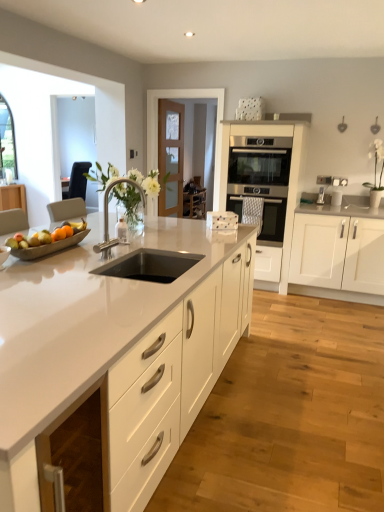
What is the approximate height of white glossy vase at right?

white glossy vase at right is 67.14 centimeters tall.

Find the location of a particular element. wooden chair at center is located at coordinates (194, 198).

This screenshot has height=512, width=384. Find the location of `white glossy cabinet at center, the third cabinetry viewed from the right`. white glossy cabinet at center, the third cabinetry viewed from the right is located at coordinates (118, 353).

This screenshot has width=384, height=512. Describe the element at coordinates (49, 243) in the screenshot. I see `matte gray tray at left` at that location.

Find the location of `white glossy vase at right`. white glossy vase at right is located at coordinates (376, 164).

In terms of size, does wooden chair at center appear bigger or smaller than satin silver oven at center?

wooden chair at center is bigger than satin silver oven at center.

Is wooden chair at center completely or partially outside of satin silver oven at center?

That's correct, wooden chair at center is outside of satin silver oven at center.

From the image's perspective, does wooden chair at center appear higher than satin silver oven at center?

Yes, from the image's perspective, wooden chair at center is on top of satin silver oven at center.

Is wooden chair at center far from satin silver oven at center?

Indeed, wooden chair at center is not near satin silver oven at center.

Is satin stainless steel oven at center, which is the second cabinetry in left-to-right order, not close to white matte cabinet at right, the 3th cabinetry viewed from the left?

satin stainless steel oven at center, which is the second cabinetry in left-to-right order, is near white matte cabinet at right, the 3th cabinetry viewed from the left, not far away.

Considering the sizes of satin stainless steel oven at center, arranged as the 2th cabinetry when viewed from the right, and white matte cabinet at right, the 1th cabinetry viewed from the right, in the image, is satin stainless steel oven at center, arranged as the 2th cabinetry when viewed from the right, taller or shorter than white matte cabinet at right, the 1th cabinetry viewed from the right,?

Considering their sizes, satin stainless steel oven at center, arranged as the 2th cabinetry when viewed from the right, has more height than white matte cabinet at right, the 1th cabinetry viewed from the right.

Between satin stainless steel oven at center, arranged as the 2th cabinetry when viewed from the right, and polished chrome faucet at center, which one has smaller size?

polished chrome faucet at center.

Between satin stainless steel oven at center, which is the second cabinetry in left-to-right order, and polished chrome faucet at center, which one has less height?

polished chrome faucet at center is shorter.

Which cabinetry is the 2nd one when counting from the back of the polished chrome faucet at center? Please provide its 2D coordinates.

[(290, 172)]

In the image, is satin stainless steel oven at center, which is the second cabinetry in left-to-right order, on the left side or the right side of polished chrome faucet at center?

Based on their positions, satin stainless steel oven at center, which is the second cabinetry in left-to-right order, is located to the right of polished chrome faucet at center.

Where is `oven that appears below the black stainless steel sink at center (from a real-world perspective)`? This screenshot has width=384, height=512. oven that appears below the black stainless steel sink at center (from a real-world perspective) is located at coordinates (273, 219).

From a real-world perspective, which is physically below, black stainless steel sink at center or satin silver oven at center?

satin silver oven at center is physically lower.

Which is more to the right, black stainless steel sink at center or satin silver oven at center?

satin silver oven at center.

Based on the photo, is there a large distance between black stainless steel sink at center and satin silver oven at center?

That's right, there is a large distance between black stainless steel sink at center and satin silver oven at center.

Considering the relative positions of black stainless steel sink at center and matte gray tray at left in the image provided, is black stainless steel sink at center to the right of matte gray tray at left from the viewer's perspective?

Yes, black stainless steel sink at center is to the right of matte gray tray at left.

Is the surface of black stainless steel sink at center in direct contact with matte gray tray at left?

No, black stainless steel sink at center is not with matte gray tray at left.

Which of these two, black stainless steel sink at center or matte gray tray at left, stands shorter?

With less height is matte gray tray at left.

Is satin silver oven at center facing away from black stainless steel sink at center?

No, satin silver oven at center is not facing away from black stainless steel sink at center.

How different are the orientations of satin silver oven at center and black stainless steel sink at center in degrees?

They differ by 90.7 degrees in their facing directions.

Is satin silver oven at center smaller than black stainless steel sink at center?

Actually, satin silver oven at center might be larger than black stainless steel sink at center.

Considering the sizes of satin silver oven at center and black stainless steel sink at center in the image, is satin silver oven at center wider or thinner than black stainless steel sink at center?

Clearly, satin silver oven at center has more width compared to black stainless steel sink at center.

Considering the sizes of objects polished chrome faucet at center and white glossy vase at right in the image provided, who is thinner, polished chrome faucet at center or white glossy vase at right?

polished chrome faucet at center.

Would you say polished chrome faucet at center is inside or outside white glossy vase at right?

The correct answer is: outside.

Who is taller, polished chrome faucet at center or white glossy vase at right?

white glossy vase at right is taller.

From a real-world perspective, relative to white glossy vase at right, is polished chrome faucet at center vertically above or below?

In terms of real-world spatial position, polished chrome faucet at center is below white glossy vase at right.

At what (x,y) coordinates should I click in order to perform the action: click on oven in front of the wooden chair at center. Please return your answer as a coordinate pair (x, y). This screenshot has width=384, height=512. Looking at the image, I should click on (273, 219).

This screenshot has height=512, width=384. I want to click on the 1st cabinetry located beneath the satin stainless steel oven at center, arranged as the 2th cabinetry when viewed from the right (from a real-world perspective), so click(330, 244).

Based on their spatial positions, is satin stainless steel oven at center, arranged as the 2th cabinetry when viewed from the right, or white glossy cabinet at center, placed as the 1th cabinetry when sorted from left to right, closer to black stainless steel sink at center?

Among the two, white glossy cabinet at center, placed as the 1th cabinetry when sorted from left to right, is located nearer to black stainless steel sink at center.

Considering their positions, is polished chrome faucet at center positioned further to satin silver oven at center than white matte cabinet at right, the 3th cabinetry viewed from the left?

polished chrome faucet at center is positioned further to the anchor satin silver oven at center.

When comparing their distances from matte gray tray at left, does satin silver oven at center or white matte cabinet at right, the 1th cabinetry viewed from the right, seem closer?

The object closer to matte gray tray at left is satin silver oven at center.

Looking at the image, which one is located closer to polished chrome faucet at center, wooden chair at center or matte gray tray at left?

Among the two, matte gray tray at left is located nearer to polished chrome faucet at center.

Based on their spatial positions, is satin silver oven at center or polished chrome faucet at center closer to satin stainless steel oven at center, which is the second cabinetry in left-to-right order?

satin silver oven at center is positioned closer to the anchor satin stainless steel oven at center, which is the second cabinetry in left-to-right order.

Estimate the real-world distances between objects in this image. Which object is further from satin stainless steel oven at center, which is the second cabinetry in left-to-right order, polished chrome faucet at center or white glossy vase at right?

Among the two, polished chrome faucet at center is located further to satin stainless steel oven at center, which is the second cabinetry in left-to-right order.

Looking at the image, which one is located further to white glossy cabinet at center, placed as the 1th cabinetry when sorted from left to right, wooden chair at center or satin silver oven at center?

Based on the image, wooden chair at center appears to be further to white glossy cabinet at center, placed as the 1th cabinetry when sorted from left to right.

Which object lies further to the anchor point polished chrome faucet at center, white glossy vase at right or satin silver oven at center?

Based on the image, white glossy vase at right appears to be further to polished chrome faucet at center.

I want to click on flower positioned between white glossy cabinet at center, placed as the 1th cabinetry when sorted from left to right, and wooden chair at center from near to far, so click(376, 164).

Where is `sink between matte gray tray at left and white glossy vase at right`? The width and height of the screenshot is (384, 512). sink between matte gray tray at left and white glossy vase at right is located at coordinates (150, 265).

This screenshot has height=512, width=384. In order to click on tap between black stainless steel sink at center and satin silver oven at center in the front-back direction in this screenshot , I will do `click(107, 217)`.

Where is `tap between matte gray tray at left and white glossy vase at right`? The image size is (384, 512). tap between matte gray tray at left and white glossy vase at right is located at coordinates (107, 217).